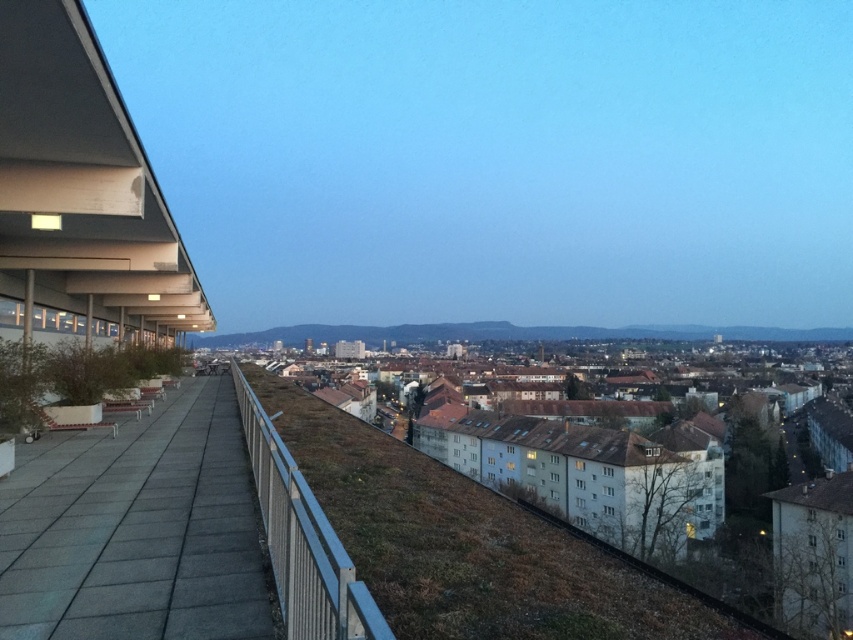
Between gray tile pavement at lower left and smooth concrete roof at left, which one appears on the right side from the viewer's perspective?

gray tile pavement at lower left

Is point (143, 442) positioned behind point (189, 272)?

That is False.

Does point (137, 634) lie behind point (143, 209)?

No.

I want to click on gray tile pavement at lower left, so click(136, 529).

Does green grass at center have a greater width compared to metallic silver rail at center?

No, green grass at center is not wider than metallic silver rail at center.

Can you confirm if green grass at center is taller than metallic silver rail at center?

Incorrect, green grass at center's height is not larger of metallic silver rail at center's.

Between point (434, 621) and point (322, 605), which one is positioned in front?

Point (322, 605)

You are a GUI agent. You are given a task and a screenshot of the screen. Output one action in this format:
    pyautogui.click(x=<x>, y=<y>)
    Task: Click on the green grass at center
    This screenshot has width=853, height=640.
    Given the screenshot: What is the action you would take?
    pyautogui.click(x=474, y=545)

Is gray tile pavement at lower left further to the viewer compared to metallic silver rail at center?

Yes, gray tile pavement at lower left is behind metallic silver rail at center.

Which is in front, point (242, 589) or point (265, 506)?

Point (242, 589) is more forward.

Does point (152, 637) come behind point (306, 502)?

That is True.

The image size is (853, 640). I want to click on gray tile pavement at lower left, so click(136, 529).